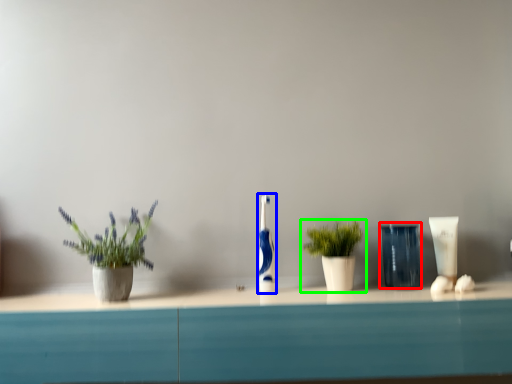
Question: Based on their relative distances, which object is nearer to glass vase (highlighted by a red box)? Choose from toothbrush (highlighted by a blue box) and houseplant (highlighted by a green box).

Choices:
 (A) toothbrush
 (B) houseplant

Answer: (B)